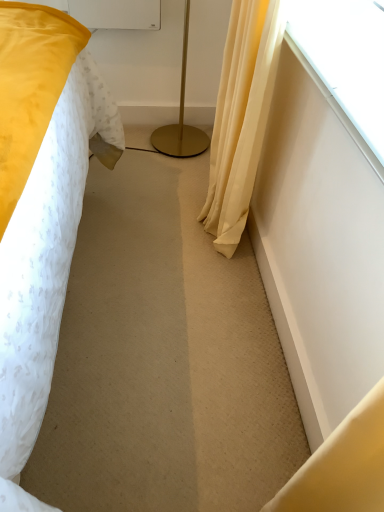
Question: Should I look upward or downward to see transparent glass window at upper right?

Choices:
 (A) up
 (B) down

Answer: (A)

Question: From a real-world perspective, is transparent glass window at upper right beneath gold metallic floor lamp at center?

Choices:
 (A) no
 (B) yes

Answer: (A)

Question: From the image's perspective, is transparent glass window at upper right over gold metallic floor lamp at center?

Choices:
 (A) no
 (B) yes

Answer: (A)

Question: Is transparent glass window at upper right to the left of gold metallic floor lamp at center from the viewer's perspective?

Choices:
 (A) yes
 (B) no

Answer: (B)

Question: Would you consider transparent glass window at upper right to be distant from gold metallic floor lamp at center?

Choices:
 (A) no
 (B) yes

Answer: (B)

Question: Is transparent glass window at upper right facing towards gold metallic floor lamp at center?

Choices:
 (A) yes
 (B) no

Answer: (B)

Question: Considering the relative sizes of transparent glass window at upper right and gold metallic floor lamp at center in the image provided, is transparent glass window at upper right wider than gold metallic floor lamp at center?

Choices:
 (A) no
 (B) yes

Answer: (A)

Question: Can you confirm if silky yellow curtain at right is thinner than transparent glass window at upper right?

Choices:
 (A) yes
 (B) no

Answer: (B)

Question: Does silky yellow curtain at right have a greater width compared to transparent glass window at upper right?

Choices:
 (A) no
 (B) yes

Answer: (B)

Question: Does silky yellow curtain at right turn towards transparent glass window at upper right?

Choices:
 (A) no
 (B) yes

Answer: (A)

Question: Is transparent glass window at upper right completely or partially inside silky yellow curtain at right?

Choices:
 (A) no
 (B) yes

Answer: (A)

Question: Is silky yellow curtain at right completely or partially outside of transparent glass window at upper right?

Choices:
 (A) no
 (B) yes

Answer: (B)

Question: Does silky yellow curtain at right come behind transparent glass window at upper right?

Choices:
 (A) no
 (B) yes

Answer: (B)

Question: Does gold metallic floor lamp at center appear on the left side of silky yellow curtain at right?

Choices:
 (A) no
 (B) yes

Answer: (B)